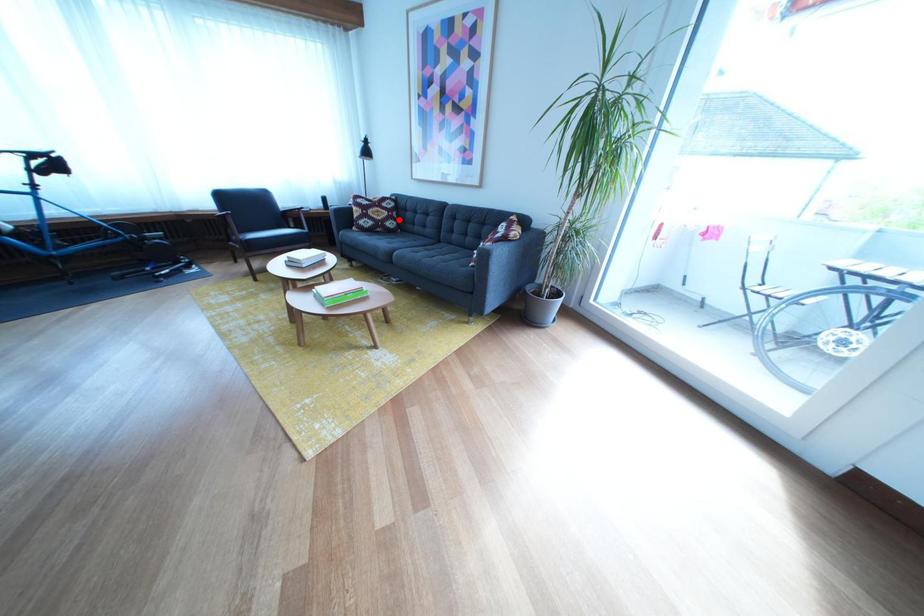
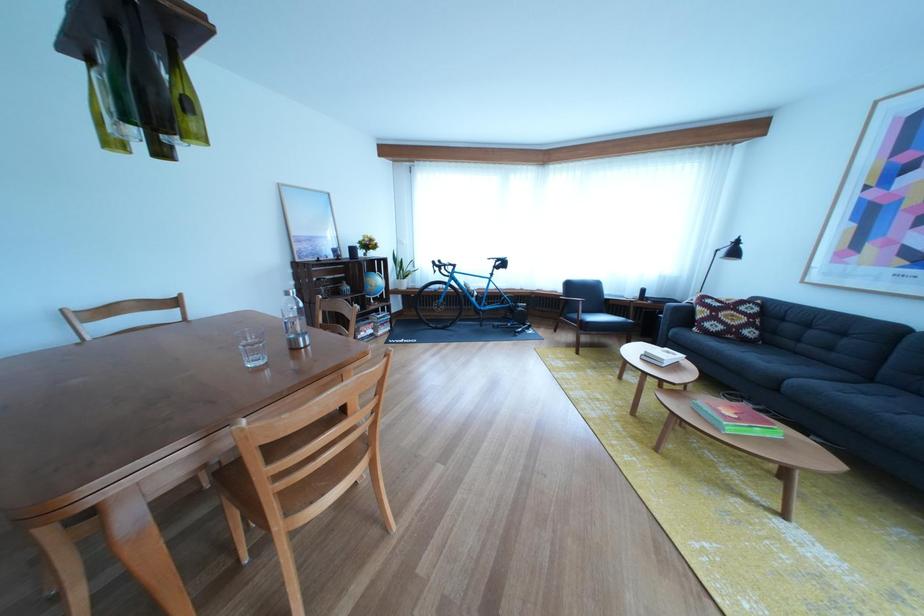
In the second image, find the point that corresponds to the highlighted location in the first image.

(757, 325)